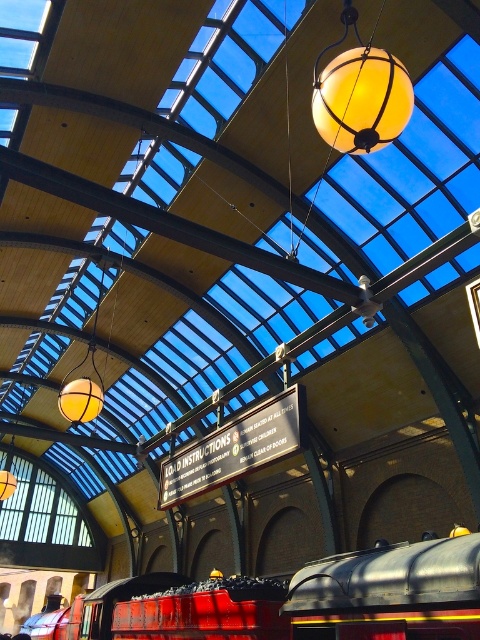
Question: Is red glossy train at center positioned before translucent glass globe at center?

Choices:
 (A) no
 (B) yes

Answer: (B)

Question: Among these objects, which one is farthest from the camera?

Choices:
 (A) red glossy train at center
 (B) translucent glass globe at center

Answer: (B)

Question: Where is red glossy train at center located in relation to translucent glass globe at center in the image?

Choices:
 (A) below
 (B) above

Answer: (A)

Question: Is red glossy train at center to the right of translucent glass globe at center from the viewer's perspective?

Choices:
 (A) no
 (B) yes

Answer: (A)